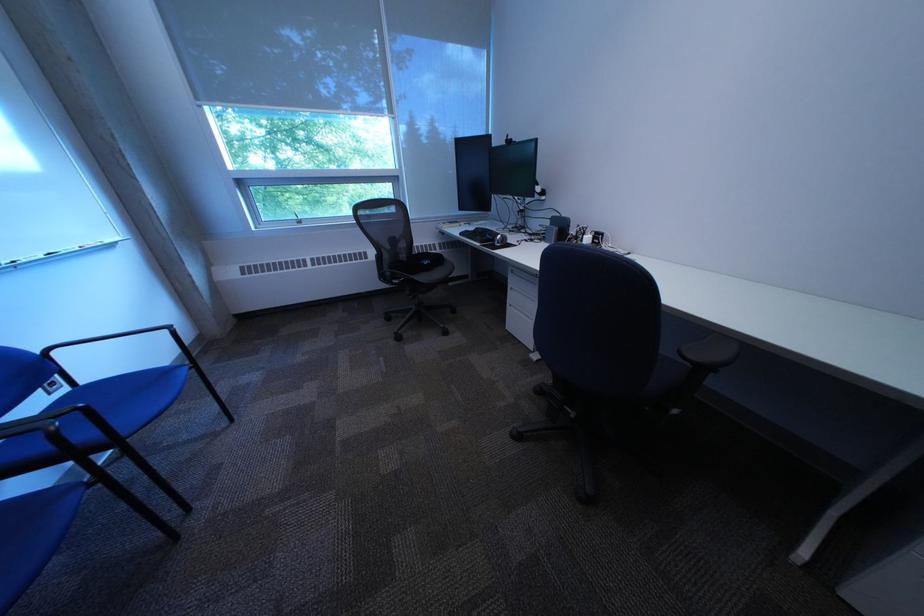
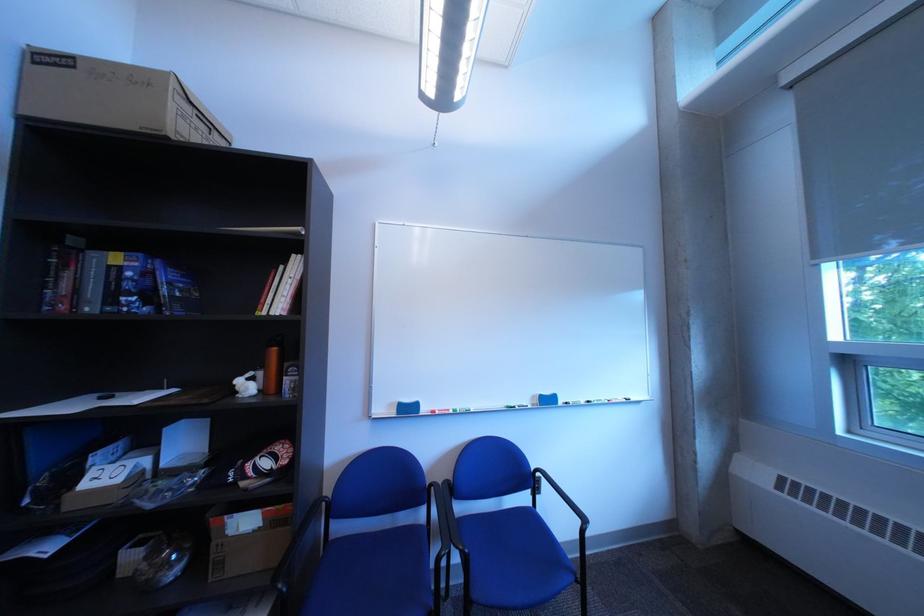
Find the pixel in the second image that matches point 99,408 in the first image.

(482, 553)